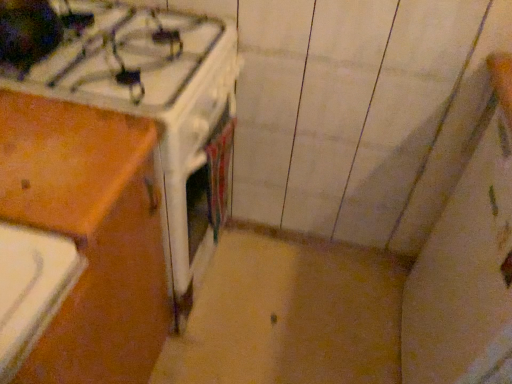
Question: Is white glossy gas stove at upper left to the right of wooden at left from the viewer's perspective?

Choices:
 (A) yes
 (B) no

Answer: (A)

Question: Is white glossy gas stove at upper left not inside wooden at left?

Choices:
 (A) yes
 (B) no

Answer: (A)

Question: Considering the relative sizes of white glossy gas stove at upper left and wooden at left in the image provided, is white glossy gas stove at upper left bigger than wooden at left?

Choices:
 (A) yes
 (B) no

Answer: (B)

Question: From the image's perspective, would you say white glossy gas stove at upper left is shown under wooden at left?

Choices:
 (A) yes
 (B) no

Answer: (B)

Question: Is white glossy gas stove at upper left further to camera compared to wooden at left?

Choices:
 (A) no
 (B) yes

Answer: (B)

Question: Does white glossy gas stove at upper left have a greater width compared to wooden at left?

Choices:
 (A) no
 (B) yes

Answer: (B)

Question: Are wooden at left and white glossy gas stove at upper left far apart?

Choices:
 (A) yes
 (B) no

Answer: (B)

Question: Is wooden at left at the left side of white glossy gas stove at upper left?

Choices:
 (A) yes
 (B) no

Answer: (A)

Question: Is the position of wooden at left less distant than that of white glossy gas stove at upper left?

Choices:
 (A) no
 (B) yes

Answer: (B)

Question: Is wooden at left positioned behind white glossy gas stove at upper left?

Choices:
 (A) yes
 (B) no

Answer: (B)

Question: From a real-world perspective, is wooden at left on white glossy gas stove at upper left?

Choices:
 (A) no
 (B) yes

Answer: (A)

Question: Does wooden at left appear on the right side of white glossy gas stove at upper left?

Choices:
 (A) no
 (B) yes

Answer: (A)

Question: Relative to wooden at left, is white glossy gas stove at upper left in front or behind?

Choices:
 (A) behind
 (B) front

Answer: (A)